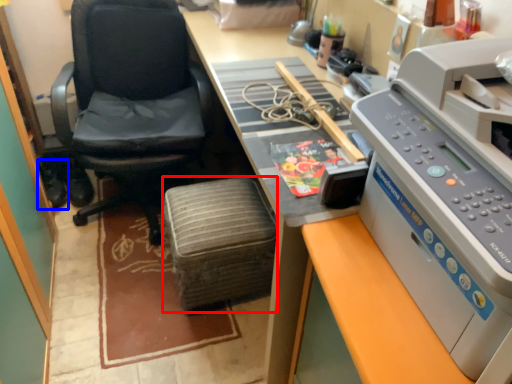
Question: Which of the following is the closest to the observer, stool (highlighted by a red box) or footwear (highlighted by a blue box)?

Choices:
 (A) stool
 (B) footwear

Answer: (A)